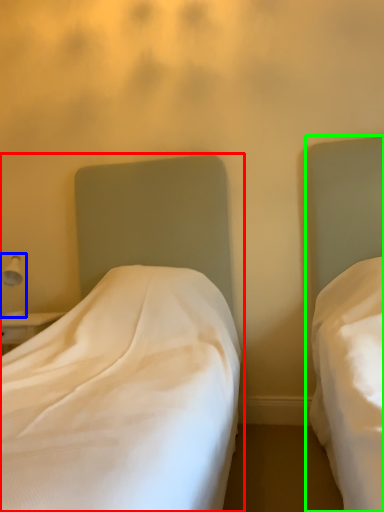
Question: Which object is the farthest from bed (highlighted by a red box)? Choose among these: bedside lamp (highlighted by a blue box) or bed (highlighted by a green box).

Choices:
 (A) bedside lamp
 (B) bed

Answer: (A)